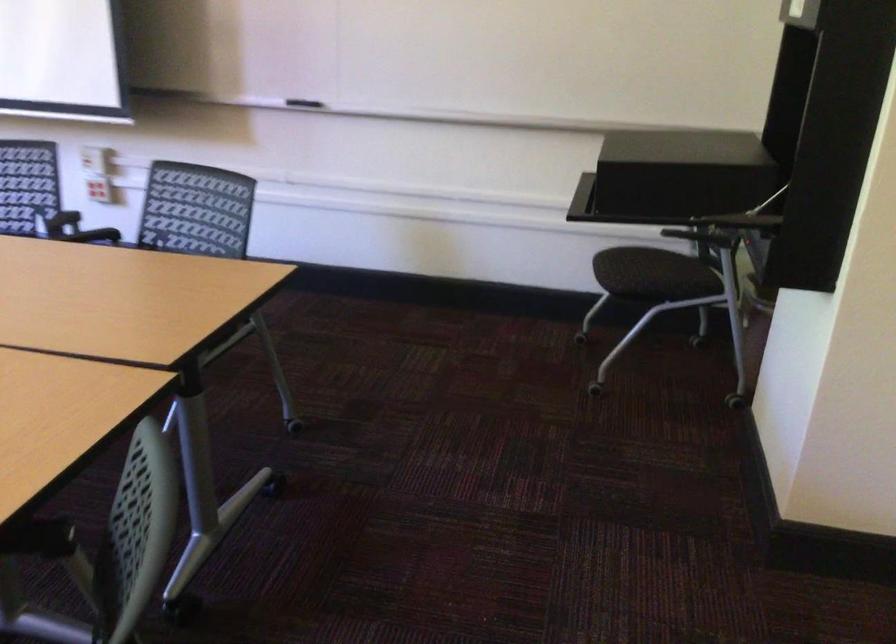
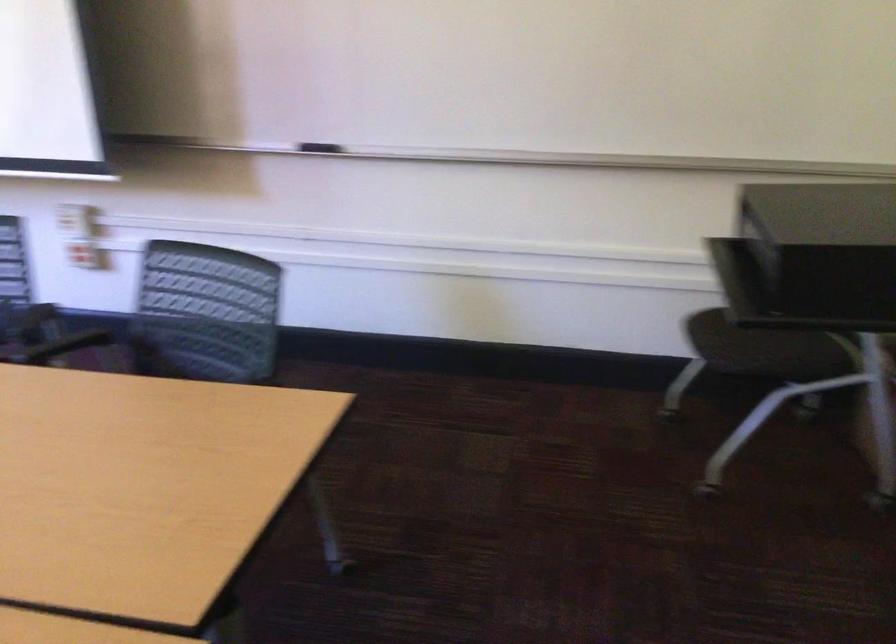
Which direction would the cameraman need to move to produce the second image?

The cameraman moved toward left, forward.